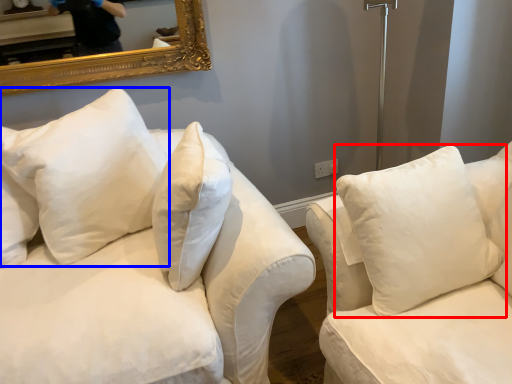
Question: Among these objects, which one is farthest to the camera, pillow (highlighted by a red box) or pillow (highlighted by a blue box)?

Choices:
 (A) pillow
 (B) pillow

Answer: (B)